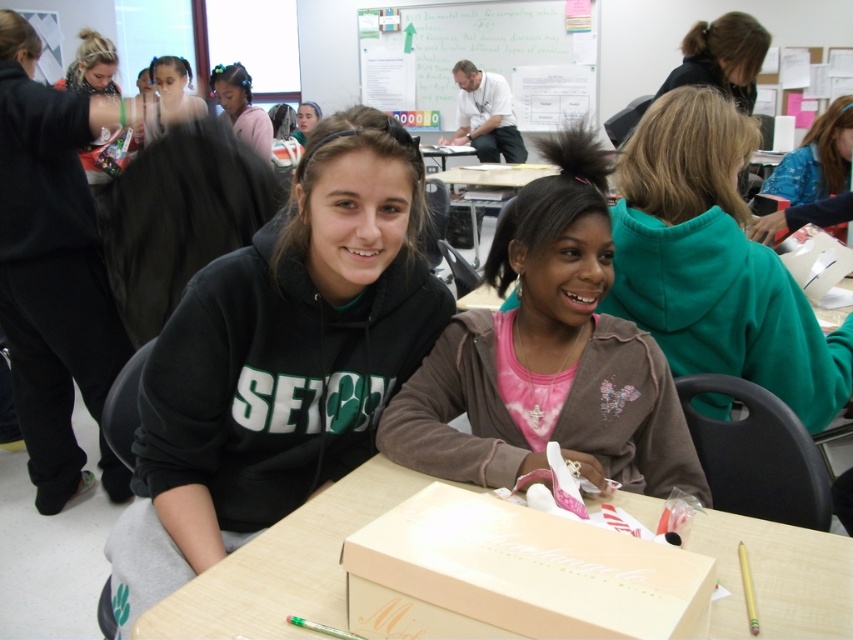
Where is the brown fleece jacket at center located in the classroom?

The brown fleece jacket at center is located at point 0.558 on the x axis and 0.642 on the y axis.

You are a student in the classroom and need to hand in an assignment. You see the matte pink cardboard box at center and the dark brown hair at upper right. Which object is located to the left of the other?

The matte pink cardboard box at center is positioned on the left side of dark brown hair at upper right.